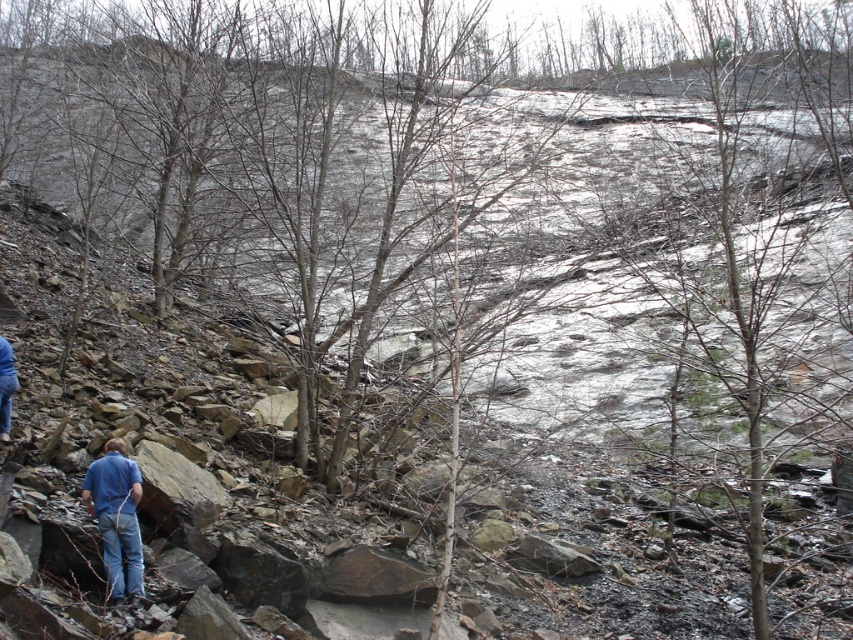
Question: Among these objects, which one is farthest from the camera?

Choices:
 (A) blue jeans at lower left
 (B) blue denim jeans at lower left

Answer: (B)

Question: Which object appears closest to the camera in this image?

Choices:
 (A) blue jeans at lower left
 (B) blue denim jeans at lower left

Answer: (A)

Question: Among these objects, which one is nearest to the camera?

Choices:
 (A) blue jeans at lower left
 (B) blue denim jeans at lower left

Answer: (A)

Question: Can you confirm if blue jeans at lower left is thinner than blue denim jeans at lower left?

Choices:
 (A) yes
 (B) no

Answer: (B)

Question: Is blue jeans at lower left below blue denim jeans at lower left?

Choices:
 (A) no
 (B) yes

Answer: (B)

Question: Is blue jeans at lower left bigger than blue denim jeans at lower left?

Choices:
 (A) yes
 (B) no

Answer: (A)